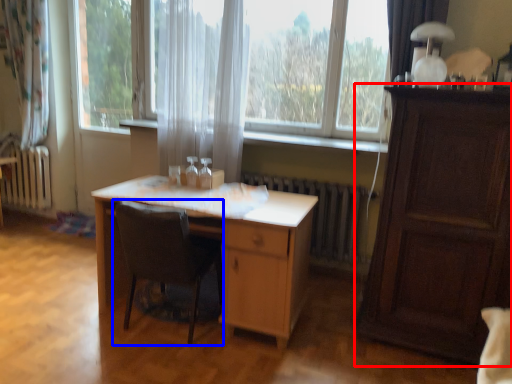
Question: Among these objects, which one is nearest to the camera, cabinetry (highlighted by a red box) or chair (highlighted by a blue box)?

Choices:
 (A) cabinetry
 (B) chair

Answer: (A)